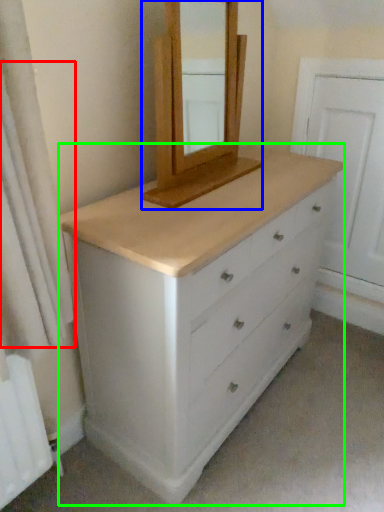
Question: Estimate the real-world distances between objects in this image. Which object is farther from shower curtain (highlighted by a red box), medicine cabinet (highlighted by a blue box) or chest of drawers (highlighted by a green box)?

Choices:
 (A) medicine cabinet
 (B) chest of drawers

Answer: (A)